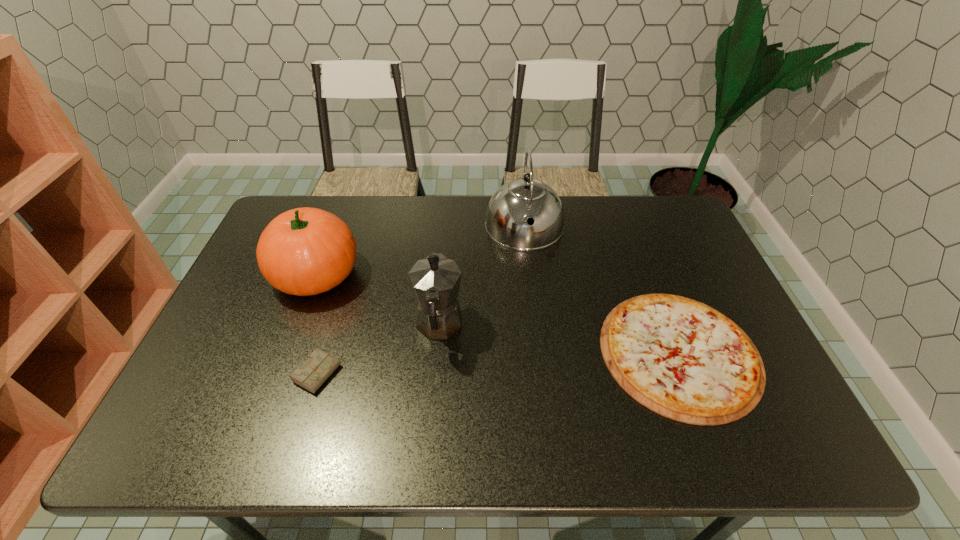
You are a GUI agent. You are given a task and a screenshot of the screen. Output one action in this format:
    pyautogui.click(x=<x>, y=<y>)
    Task: Click on the vacant region located on the back of the pumpkin
    
    Given the screenshot: What is the action you would take?
    pyautogui.click(x=335, y=223)

Where is `free location located on the back of the diary`? free location located on the back of the diary is located at coordinates (343, 293).

The height and width of the screenshot is (540, 960). In order to click on blank space located 0.330m on the back of the rightmost object in this screenshot , I will do `click(630, 224)`.

Find the location of `object at the far edge`. object at the far edge is located at coordinates (517, 201).

The height and width of the screenshot is (540, 960). I want to click on object located at the near edge, so tap(680, 358).

Identify the location of object located in the left edge section of the desktop. (305, 251).

Find the location of a particular element. This screenshot has width=960, height=540. object that is at the right edge is located at coordinates (680, 358).

The width and height of the screenshot is (960, 540). In order to click on object positioned at the near right corner in this screenshot , I will do `click(680, 358)`.

The image size is (960, 540). I want to click on free region at the far edge of the desktop, so click(582, 219).

The width and height of the screenshot is (960, 540). In order to click on free space at the near edge of the desktop in this screenshot , I will do `click(458, 443)`.